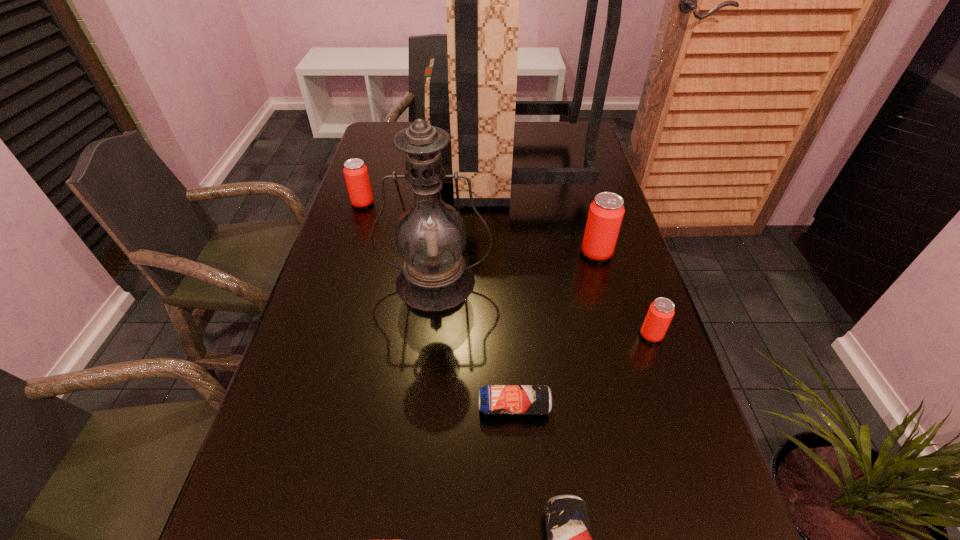
Where is `oil lamp that is at the left edge`? The width and height of the screenshot is (960, 540). oil lamp that is at the left edge is located at coordinates (430, 235).

You are a GUI agent. You are given a task and a screenshot of the screen. Output one action in this format:
    pyautogui.click(x=<x>, y=<y>)
    Task: Click on the beer can positioned at the left edge
    The image size is (960, 540).
    Given the screenshot: What is the action you would take?
    pyautogui.click(x=355, y=171)

The height and width of the screenshot is (540, 960). Identify the location of backpack located in the right edge section of the desktop. (471, 94).

Where is `object positioned at the far right corner`? The image size is (960, 540). object positioned at the far right corner is located at coordinates (471, 94).

This screenshot has height=540, width=960. Identify the location of free space at the left edge of the desktop. (283, 516).

You are a GUI agent. You are given a task and a screenshot of the screen. Output one action in this format:
    pyautogui.click(x=<x>, y=<y>)
    Task: Click on the free space at the right edge
    
    Given the screenshot: What is the action you would take?
    pyautogui.click(x=588, y=288)

I want to click on vacant space that's between the second nearest beer can and the oil lamp, so click(x=474, y=344).

You are a GUI agent. You are given a task and a screenshot of the screen. Output one action in this format:
    pyautogui.click(x=<x>, y=<y>)
    Task: Click on the vacant area that lies between the smaller blue beer can and the gray oil lamp
    
    Given the screenshot: What is the action you would take?
    pyautogui.click(x=474, y=344)

At what (x,y) coordinates should I click in order to perform the action: click on free spot between the smallest red beer can and the oil lamp. Please return your answer as a coordinate pair (x, y). Looking at the image, I should click on click(x=543, y=308).

Where is `vacant space that is in between the shortest object and the rightmost red beer can`? Image resolution: width=960 pixels, height=540 pixels. vacant space that is in between the shortest object and the rightmost red beer can is located at coordinates (583, 371).